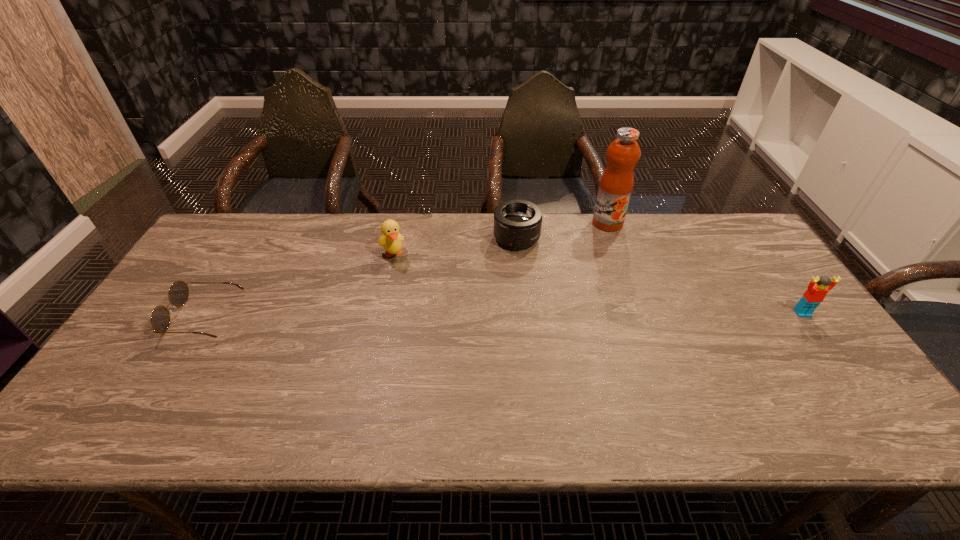
Where is `free space on the desktop that is between the leftmost object and the Lego and is positioned on the front-facing side of the duckling`? The height and width of the screenshot is (540, 960). free space on the desktop that is between the leftmost object and the Lego and is positioned on the front-facing side of the duckling is located at coordinates (420, 315).

In order to click on vacant spot on the desktop that is between the shortest object and the Lego and is positioned on the side of the third object from right to left with brand markings and control switches in this screenshot , I will do `click(542, 314)`.

Where is `vacant space on the desktop that is between the leftmost object and the rightmost object and is positioned on the front label of the fruit juice`? Image resolution: width=960 pixels, height=540 pixels. vacant space on the desktop that is between the leftmost object and the rightmost object and is positioned on the front label of the fruit juice is located at coordinates (589, 314).